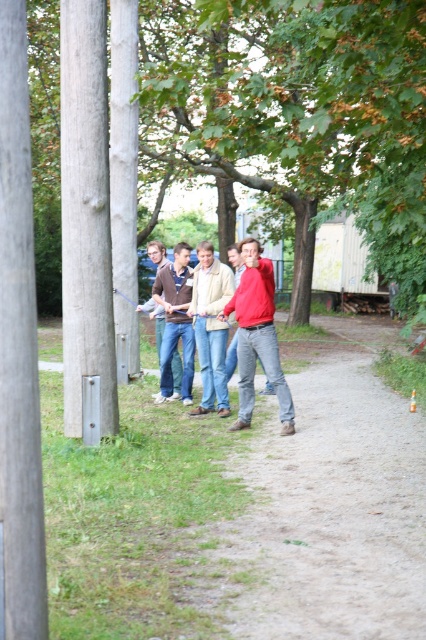
Question: Which of the following is the closest to the observer?

Choices:
 (A) (6, 189)
 (B) (232, 348)
 (C) (207, 381)
 (D) (271, 378)

Answer: (A)

Question: Is light brown wood pole at left above matte red hoodie at center?

Choices:
 (A) yes
 (B) no

Answer: (A)

Question: Among these points, which one is farthest from the camera?

Choices:
 (A) (132, 333)
 (B) (25, 108)
 (C) (314, 435)

Answer: (A)

Question: Is matte red jacket at center positioned behind light beige jacket at center?

Choices:
 (A) yes
 (B) no

Answer: (B)

Question: Can you confirm if dirt path at center is positioned to the right of matte red jacket at center?

Choices:
 (A) yes
 (B) no

Answer: (A)

Question: Which object is the closest to the matte red hoodie at center?

Choices:
 (A) light beige jacket at center
 (B) smooth concrete pole at left

Answer: (A)